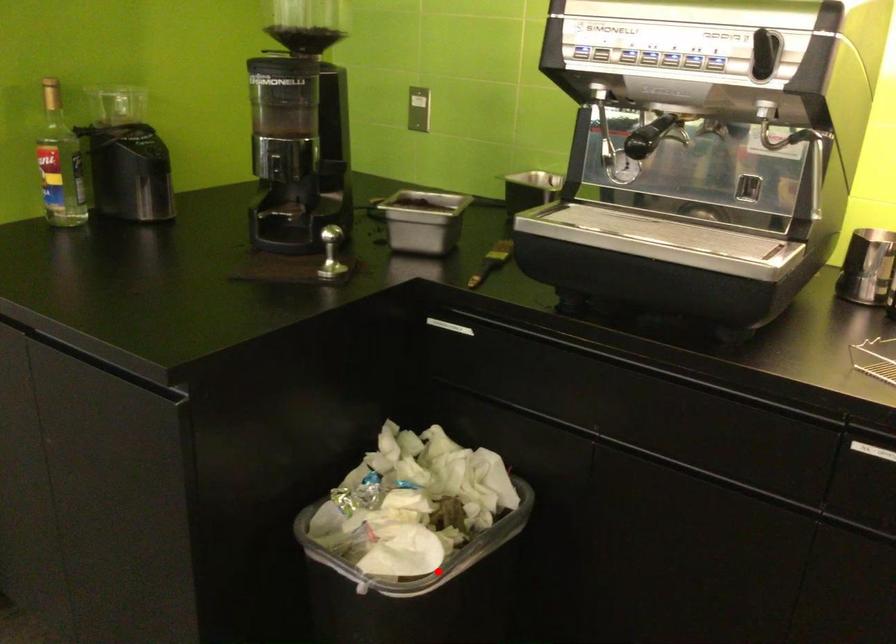
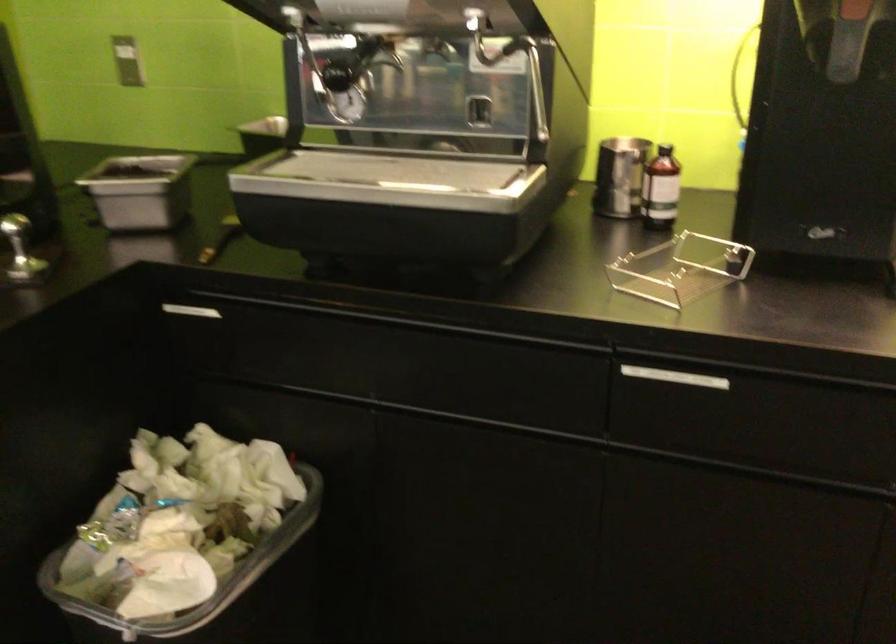
In the second image, find the point that corresponds to the highlighted location in the first image.

(218, 592)